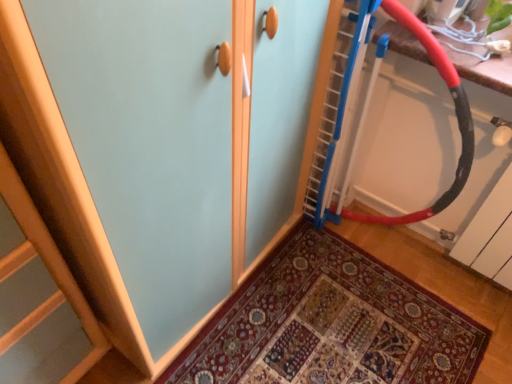
The width and height of the screenshot is (512, 384). Find the location of `vacant point to the left of red rubber battle rope at upper right`. vacant point to the left of red rubber battle rope at upper right is located at coordinates (302, 263).